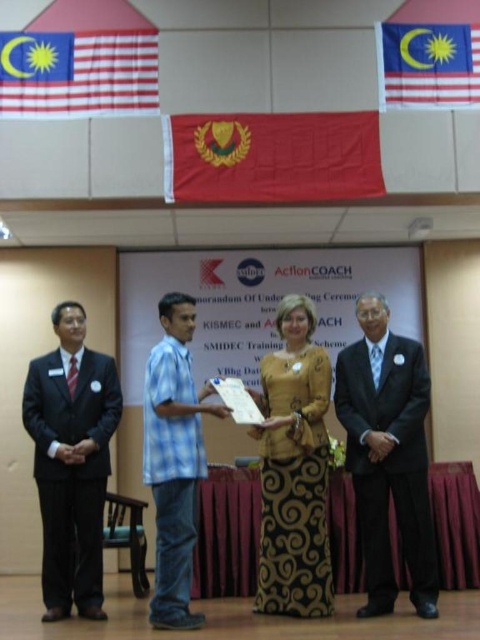
Is point (59, 550) positioned in front of point (90, 88)?

Yes, it is.

What are the coordinates of `black suit at left` in the screenshot? It's located at (72, 461).

Can you confirm if red fabric flag at center is bigger than red fabric flag at upper right?

Correct, red fabric flag at center is larger in size than red fabric flag at upper right.

Which of these two, red fabric flag at center or red fabric flag at upper right, stands taller?

With more height is red fabric flag at upper right.

At what (x,y) coordinates should I click in order to perform the action: click on red fabric flag at center. Please return your answer as a coordinate pair (x, y). Image resolution: width=480 pixels, height=640 pixels. Looking at the image, I should click on coord(272,157).

Does red fabric flag at center appear under blue plaid shirt at center?

Actually, red fabric flag at center is above blue plaid shirt at center.

Which is below, red fabric flag at center or blue plaid shirt at center?

blue plaid shirt at center is lower down.

Identify the location of red fabric flag at center. (272, 157).